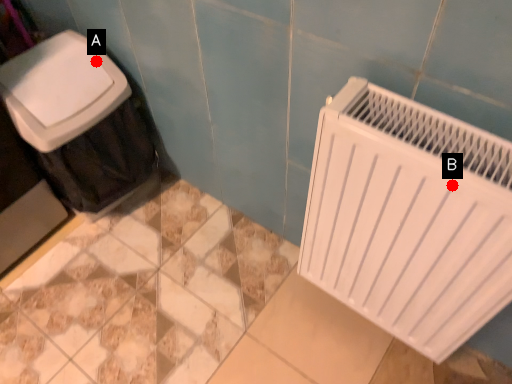
Question: Two points are circled on the image, labeled by A and B beside each circle. Which point is farther from the camera taking this photo?

Choices:
 (A) A is further
 (B) B is further

Answer: (A)